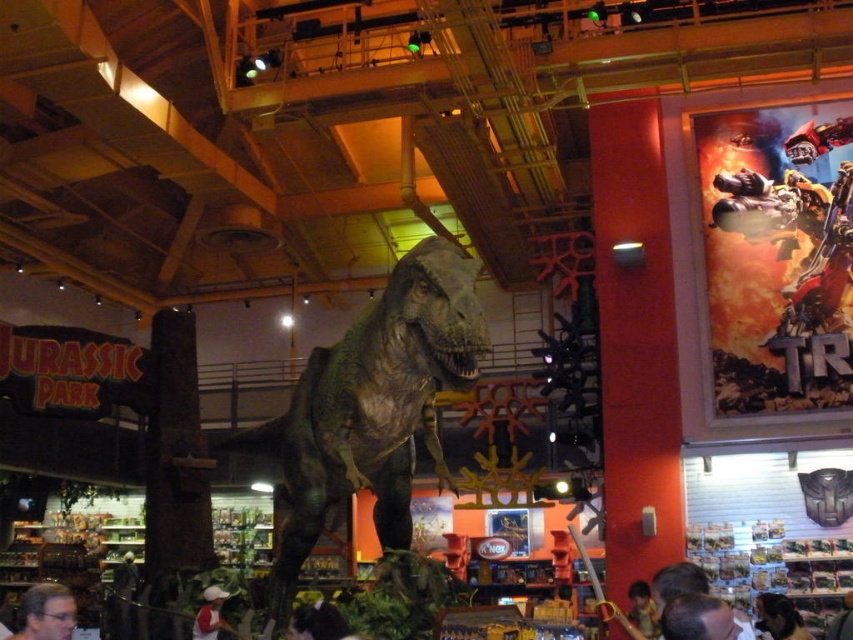
Question: Is metallic transformer figure at upper right smaller than light brown hair at lower right?

Choices:
 (A) no
 (B) yes

Answer: (A)

Question: Is matte black hair at lower left above light brown hair at lower right?

Choices:
 (A) yes
 (B) no

Answer: (A)

Question: Is smooth brown hair at lower center bigger than white cotton shirt at lower center?

Choices:
 (A) yes
 (B) no

Answer: (B)

Question: Which point appears closest to the camera in this image?

Choices:
 (A) (728, 609)
 (B) (646, 595)

Answer: (A)

Question: Which object appears farthest from the camera in this image?

Choices:
 (A) light brown hair at lower right
 (B) green textured dinosaur at center
 (C) white cotton shirt at lower center
 (D) matte black hair at lower left

Answer: (A)

Question: Which object appears farthest from the camera in this image?

Choices:
 (A) metallic transformer figure at upper right
 (B) matte black hair at lower left
 (C) smooth brown hair at lower center
 (D) light brown hair at lower right

Answer: (A)